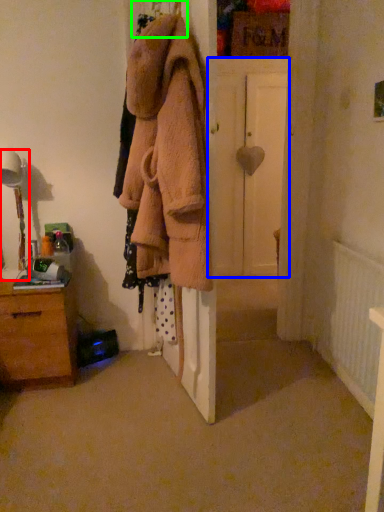
Question: Which is farther away from table lamp (highlighted by a red box)? door (highlighted by a blue box) or hanger (highlighted by a green box)?

Choices:
 (A) door
 (B) hanger

Answer: (A)